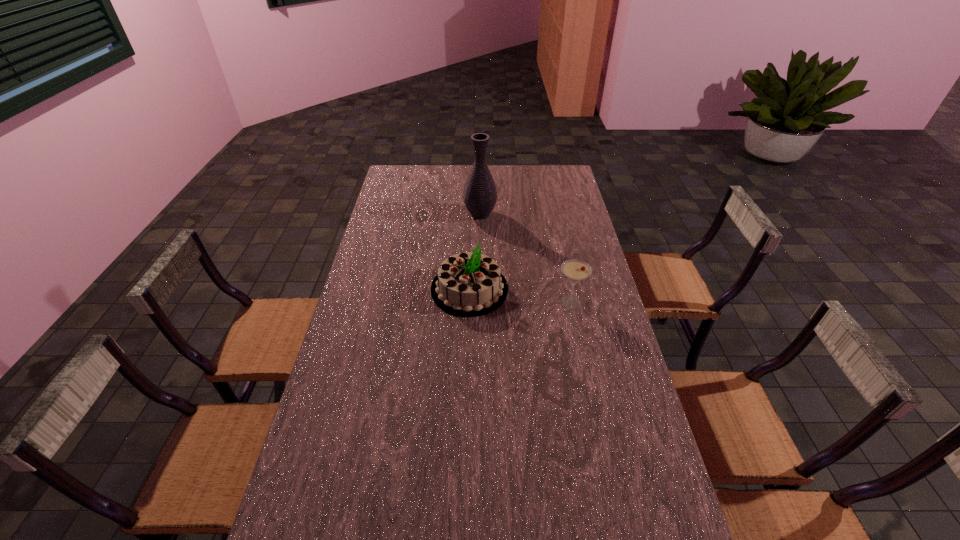
This screenshot has height=540, width=960. Identify the location of free region that satisfies the following two spatial constraints: 1. on the front side of the rightmost object; 2. on the left side of the birthday cake. (x=469, y=302).